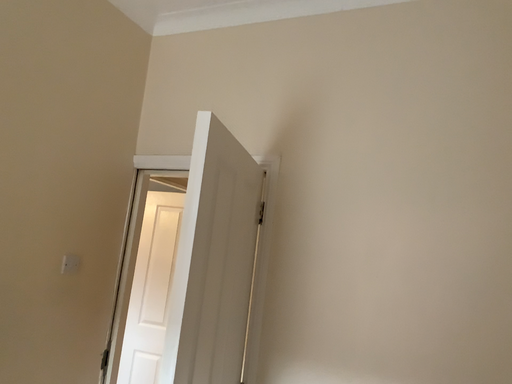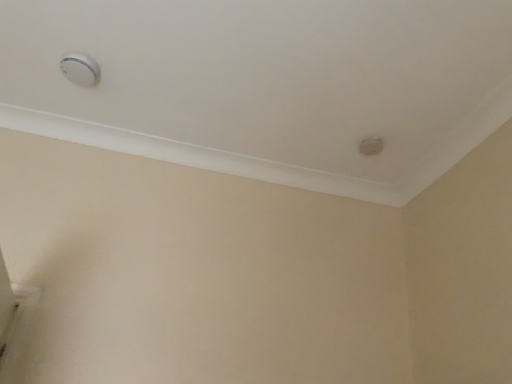
Question: Which way did the camera rotate in the video?

Choices:
 (A) rotated left
 (B) rotated right

Answer: (B)